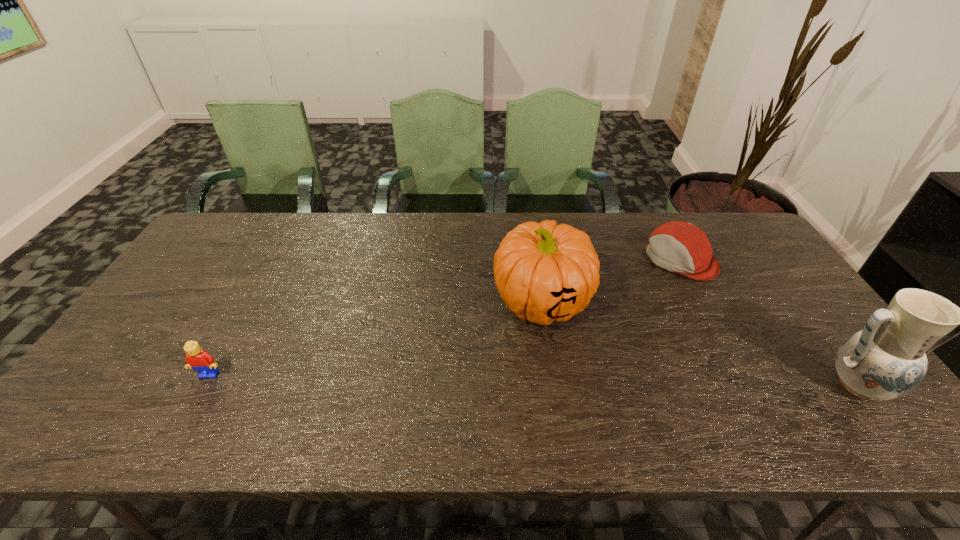
What are the coordinates of `free space at the far left corner of the desktop` in the screenshot? It's located at (252, 222).

In the image, there is a desktop. In order to click on free space at the near left corner in this screenshot , I will do `click(109, 377)`.

This screenshot has height=540, width=960. I want to click on vacant area between the cap and the second object from left to right, so click(x=611, y=280).

Where is `vacant point located between the rightmost object and the cap`? vacant point located between the rightmost object and the cap is located at coordinates (769, 323).

Locate an element on the screen. vacant space that's between the leftmost object and the pumpkin is located at coordinates click(x=375, y=338).

You are a GUI agent. You are given a task and a screenshot of the screen. Output one action in this format:
    pyautogui.click(x=<x>, y=<y>)
    Task: Click on the free space between the rightmost object and the Lego
    This screenshot has height=540, width=960.
    Given the screenshot: What is the action you would take?
    pyautogui.click(x=534, y=380)

Locate an element on the screen. This screenshot has width=960, height=540. blank region between the leftmost object and the cap is located at coordinates (444, 318).

This screenshot has width=960, height=540. In order to click on free spot between the third object from right to left and the cap in this screenshot , I will do `click(611, 280)`.

Locate an element on the screen. Image resolution: width=960 pixels, height=540 pixels. vacant region between the leftmost object and the cap is located at coordinates (444, 318).

You are a GUI agent. You are given a task and a screenshot of the screen. Output one action in this format:
    pyautogui.click(x=<x>, y=<y>)
    Task: Click on the vacant region between the second object from left to right and the leftmost object
    The image size is (960, 540).
    Given the screenshot: What is the action you would take?
    pyautogui.click(x=375, y=338)